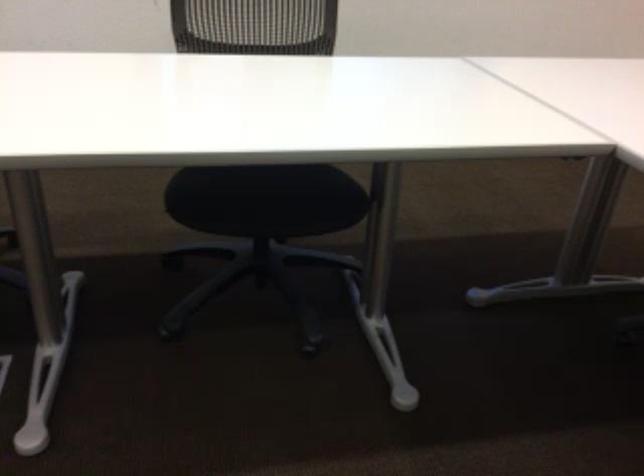
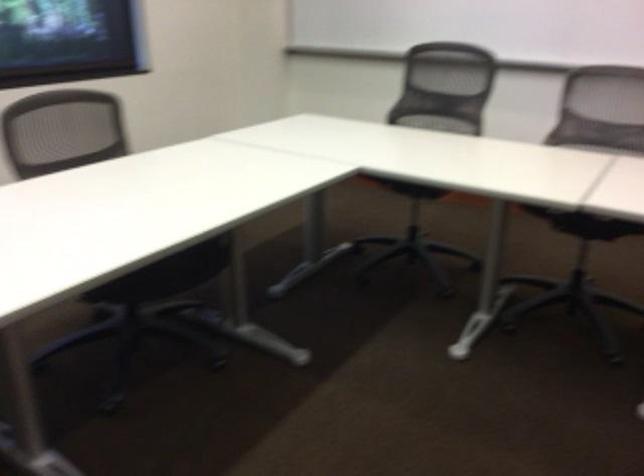
Question: How did the camera likely rotate?

Choices:
 (A) Left
 (B) Right
 (C) Up
 (D) Down

Answer: (B)